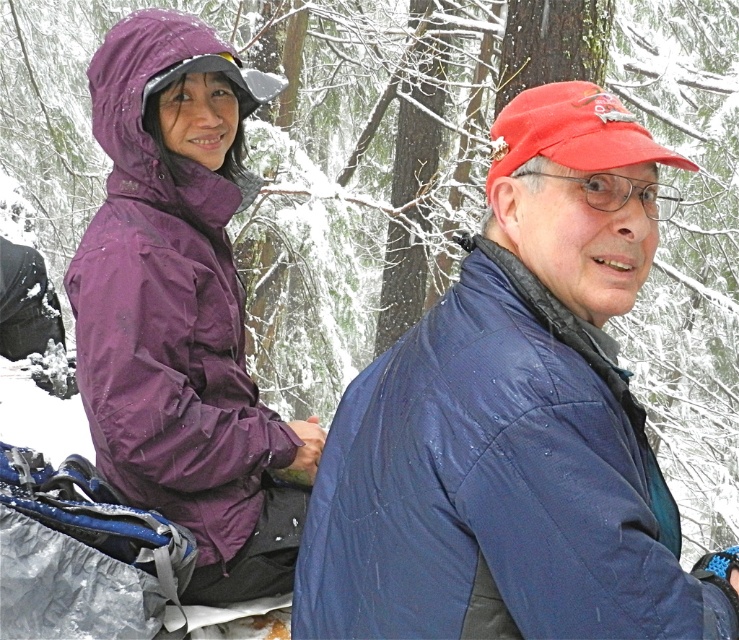
Question: Considering the relative positions of blue quilted jacket at right and purple waterproof jacket at left in the image provided, where is blue quilted jacket at right located with respect to purple waterproof jacket at left?

Choices:
 (A) right
 (B) left

Answer: (A)

Question: Is blue quilted jacket at right bigger than purple waterproof jacket at left?

Choices:
 (A) no
 (B) yes

Answer: (B)

Question: Considering the relative positions of blue quilted jacket at right and purple waterproof jacket at left in the image provided, where is blue quilted jacket at right located with respect to purple waterproof jacket at left?

Choices:
 (A) below
 (B) above

Answer: (A)

Question: Which point appears farthest from the camera in this image?

Choices:
 (A) (140, 445)
 (B) (471, 352)

Answer: (A)